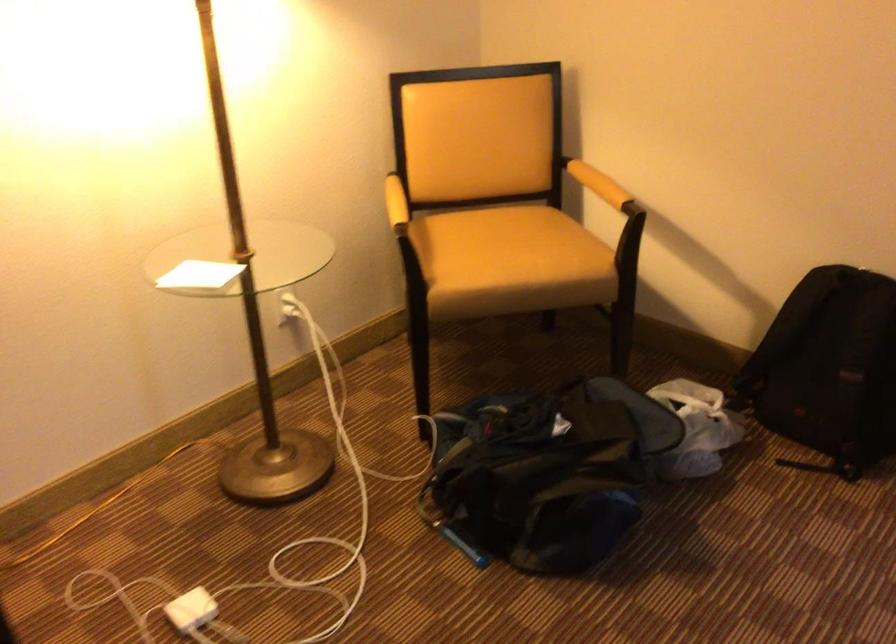
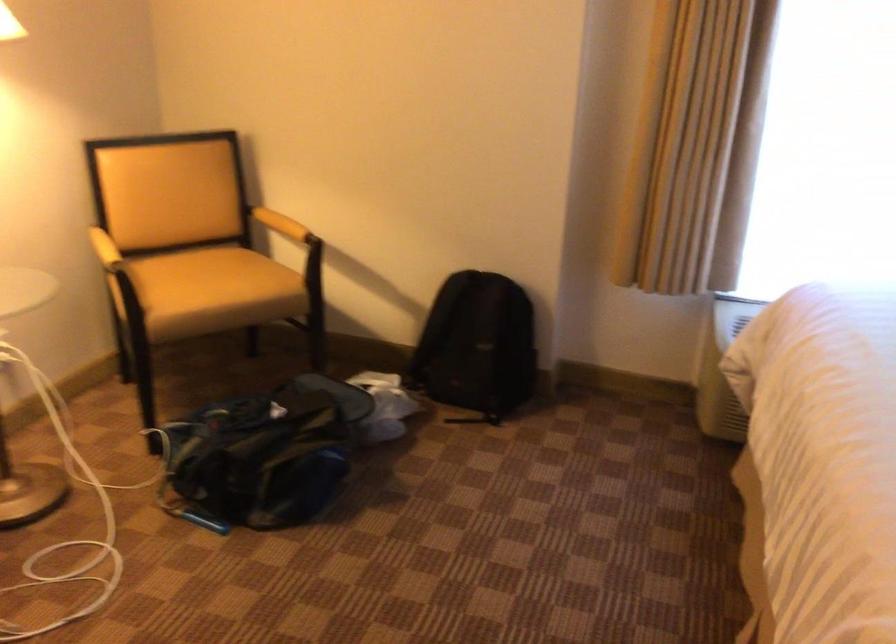
Question: How did the camera likely rotate?

Choices:
 (A) Left
 (B) Right
 (C) Up
 (D) Down

Answer: (B)